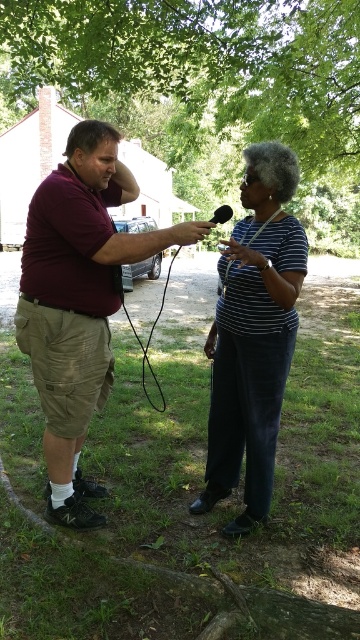
Question: Does green leafy tree at upper center appear on the right side of maroon shirt at left?

Choices:
 (A) yes
 (B) no

Answer: (A)

Question: Among these objects, which one is nearest to the camera?

Choices:
 (A) green leafy tree at upper center
 (B) maroon shirt at left

Answer: (B)

Question: Can you confirm if green leafy tree at upper center is smaller than black matte microphone at center?

Choices:
 (A) no
 (B) yes

Answer: (A)

Question: Which object is positioned farthest from the green leafy tree at upper center?

Choices:
 (A) striped fabric shirt at center
 (B) black matte microphone at center

Answer: (A)

Question: Is striped fabric shirt at center thinner than black matte microphone at center?

Choices:
 (A) yes
 (B) no

Answer: (A)

Question: Which point is closer to the camera?

Choices:
 (A) striped fabric shirt at center
 (B) black matte microphone at center
 (C) maroon shirt at left

Answer: (A)